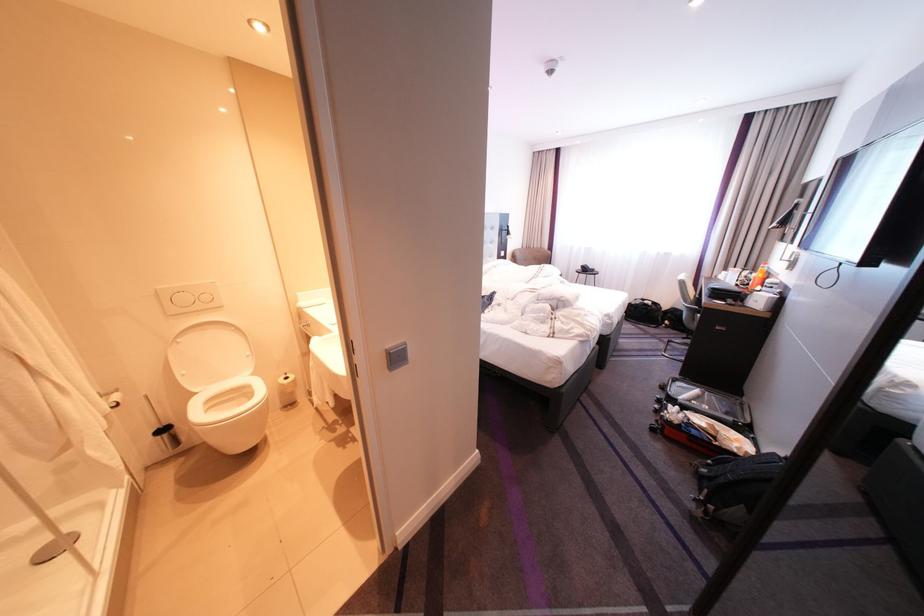
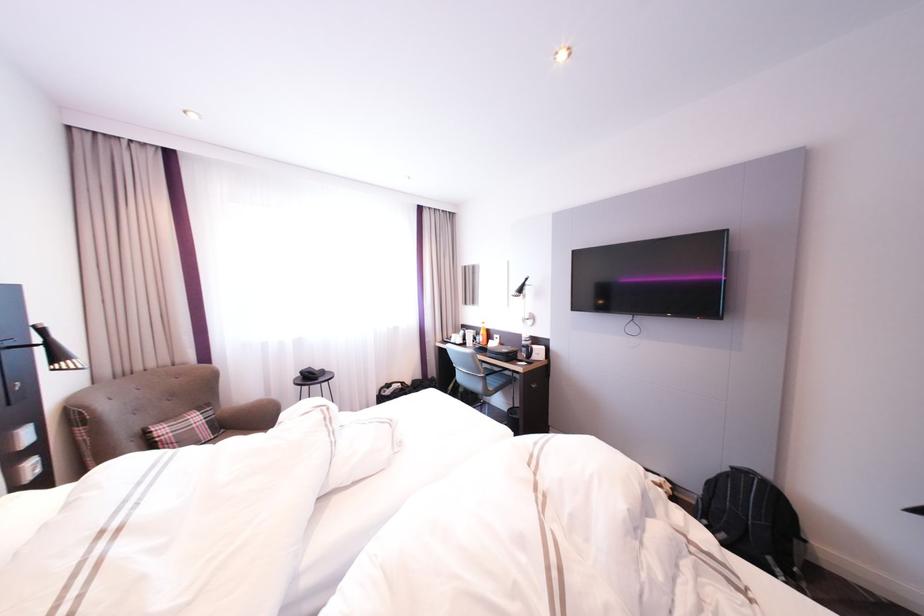
In the second image, find the point that corresponds to pixel 697 302 in the first image.

(492, 373)